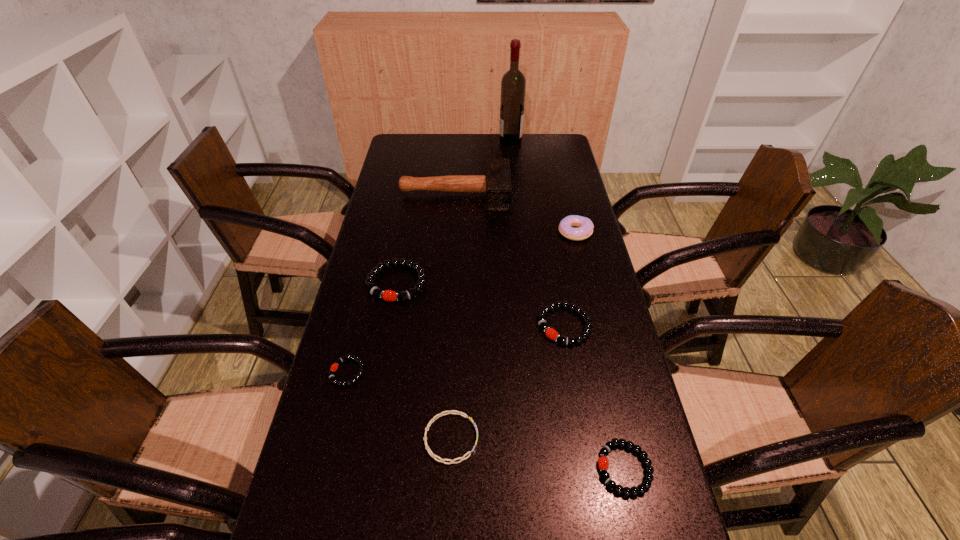
Locate an element on the screen. the closest bracelet to the doughnut is located at coordinates (550, 332).

Point out which bracelet is positioned as the fifth nearest to the farthest object. Please provide its 2D coordinates. Your answer should be formatted as a tuple, i.e. [(x, y)], where the tuple contains the x and y coordinates of a point satisfying the conditions above.

[(603, 462)]

Locate which black bracelet ranks second in proximity to the third bracelet from right to left. Please provide its 2D coordinates. Your answer should be formatted as a tuple, i.e. [(x, y)], where the tuple contains the x and y coordinates of a point satisfying the conditions above.

[(550, 332)]

Locate which black bracelet ranks second in proximity to the mallet. Please provide its 2D coordinates. Your answer should be formatted as a tuple, i.e. [(x, y)], where the tuple contains the x and y coordinates of a point satisfying the conditions above.

[(550, 332)]

The image size is (960, 540). Find the location of `vacant area that satisfies the following two spatial constraints: 1. on the front and back of the second biggest black bracelet; 2. on the left side of the green alcohol`. vacant area that satisfies the following two spatial constraints: 1. on the front and back of the second biggest black bracelet; 2. on the left side of the green alcohol is located at coordinates (529, 326).

I want to click on vacant area in the image that satisfies the following two spatial constraints: 1. on the hammer head face of the second tallest object; 2. on the right side of the fourth nearest bracelet, so 445,326.

At what (x,y) coordinates should I click in order to perform the action: click on free space that satisfies the following two spatial constraints: 1. on the front side of the tallest bracelet; 2. on the left side of the third nearest black bracelet. Please return your answer as a coordinate pair (x, y). Looking at the image, I should click on (389, 326).

Identify the location of free space that satisfies the following two spatial constraints: 1. on the hammer head face of the second farthest object; 2. on the left side of the sixth nearest object. (452, 232).

I want to click on free spot that satisfies the following two spatial constraints: 1. on the front side of the nearest black bracelet; 2. on the left side of the second nearest black bracelet, so click(324, 468).